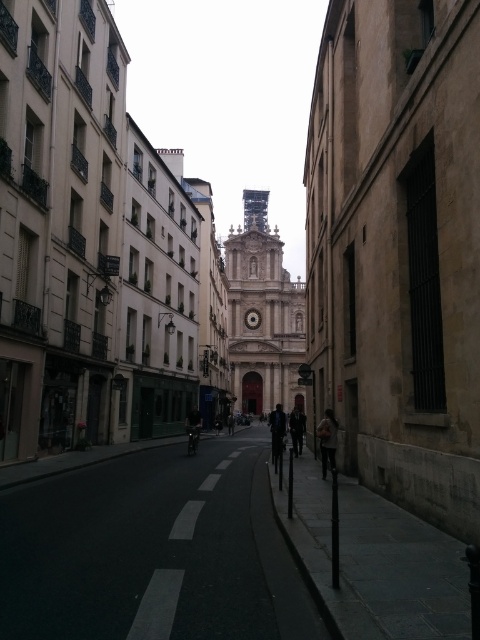
You are a tourist standing on the narrow street and want to take a photo of the dark gray fabric jacket at center without the smooth stone tower at center blocking the view. Is this possible?

The dark gray fabric jacket at center is behind the smooth stone tower at center, so it is currently blocked by the tower. To take a photo of the jacket without the tower blocking the view, you would need to move around the tower or find a different angle where the jacket is visible without the tower obstructing it.

You are a tourist standing on the street in front of the church. You see the dark asphalt road at center and the dark blue jeans at center. Which object is closer to your feet?

The dark blue jeans at center are closer to your feet because they are positioned above the dark asphalt road at center.

You are a pedestrian standing on the narrow street in front of the church. You see a gray fabric bag at center and a dark gray fabric jacket at center. Which item is closer to you?

The gray fabric bag at center is closer to you because it is in front of the dark gray fabric jacket at center.